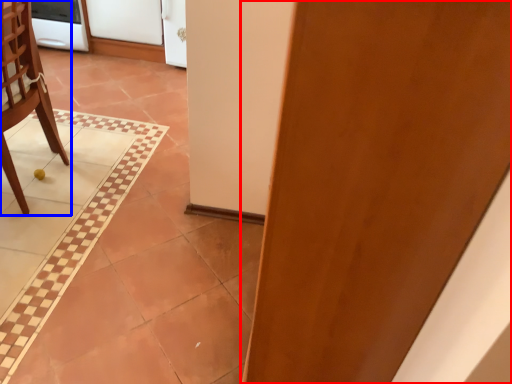
Question: Which point is further to the camera, door (highlighted by a red box) or chair (highlighted by a blue box)?

Choices:
 (A) door
 (B) chair

Answer: (B)